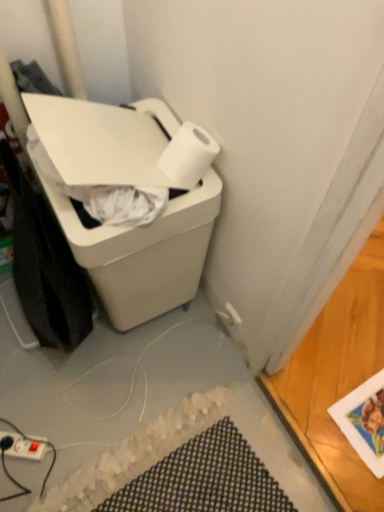
This screenshot has height=512, width=384. Identify the location of free space that is in between black textured bath mat at lower center and matte white power plugs and sockets at lower left. coord(82,433).